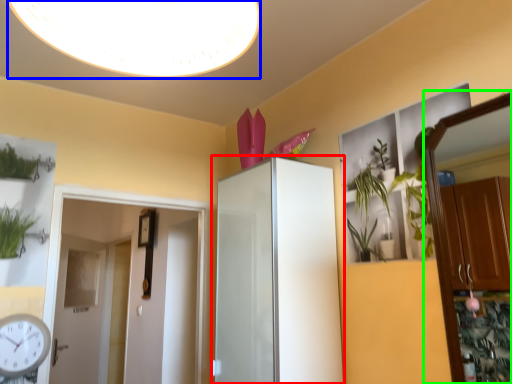
Question: Which is farther away from cabinetry (highlighted by a red box)? light fixture (highlighted by a blue box) or dresser (highlighted by a green box)?

Choices:
 (A) light fixture
 (B) dresser

Answer: (B)